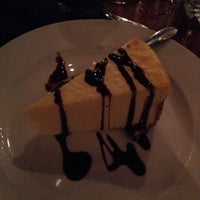
The image size is (200, 200). I want to click on silverware, so click(x=161, y=32).